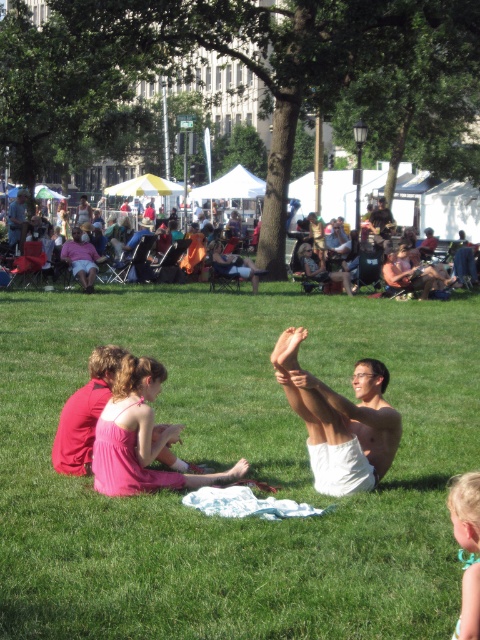
Does point (429, 188) lie in front of point (71, 256)?

That is False.

Can you confirm if matte orange tent at center is positioned to the left of matte pink dress at center?

No, matte orange tent at center is not to the left of matte pink dress at center.

Between point (472, 221) and point (62, 256), which one is positioned behind?

Point (472, 221)

At what (x,y) coordinates should I click in order to perform the action: click on matte orange tent at center. Please return your answer as a coordinate pair (x, y). The image size is (480, 640). Looking at the image, I should click on (451, 209).

Can you confirm if pink satin dress at lower left is wider than blonde hair at lower right?

Yes, pink satin dress at lower left is wider than blonde hair at lower right.

The height and width of the screenshot is (640, 480). In order to click on pink satin dress at lower left in this screenshot , I will do `click(141, 436)`.

Who is positioned more to the left, matte pink dress at center or matte black laptop at upper left?

From the viewer's perspective, matte black laptop at upper left appears more on the left side.

Does point (61, 253) come farther from viewer compared to point (24, 230)?

No, (61, 253) is in front of (24, 230).

Does point (96, 268) come farther from viewer compared to point (15, 212)?

No, (96, 268) is in front of (15, 212).

The image size is (480, 640). What are the coordinates of `matte pink dress at center` in the screenshot? It's located at (82, 259).